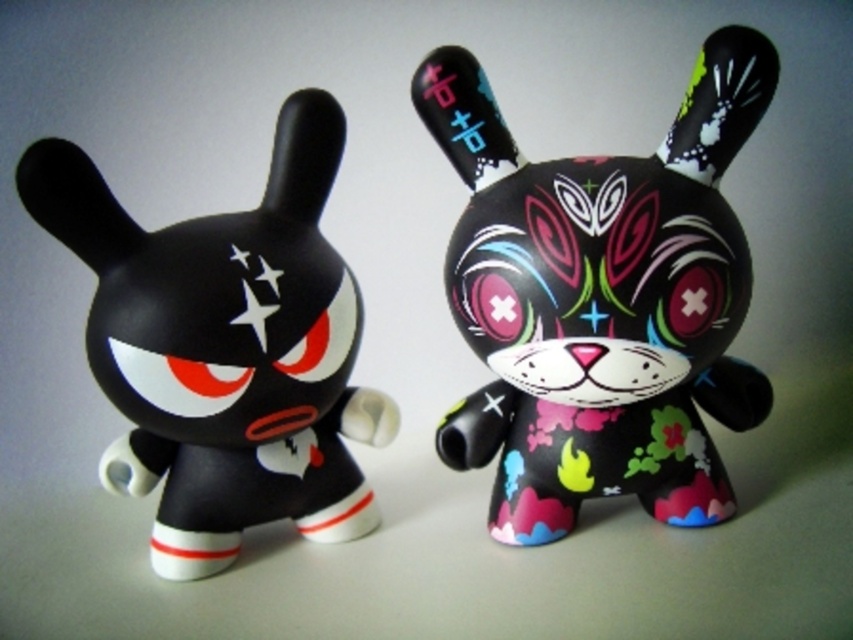
You are holding a measuring tape and want to measure the distance between you and the matte black rabbit at center. If your arm is 28 inches long when extended, can you reach it with your measuring tape?

The distance between you and the matte black rabbit at center is 38.22 inches. Since your arm is only 28 inches long when extended, you cannot reach it with your measuring tape.

You are an art collector who wants to display the matte black rabbit at center and the matte black toy at left on a shelf. Which one should you place on the higher shelf to accommodate their sizes?

The matte black rabbit at center is much taller than the matte black toy at left, so you should place it on the higher shelf to accommodate its size.